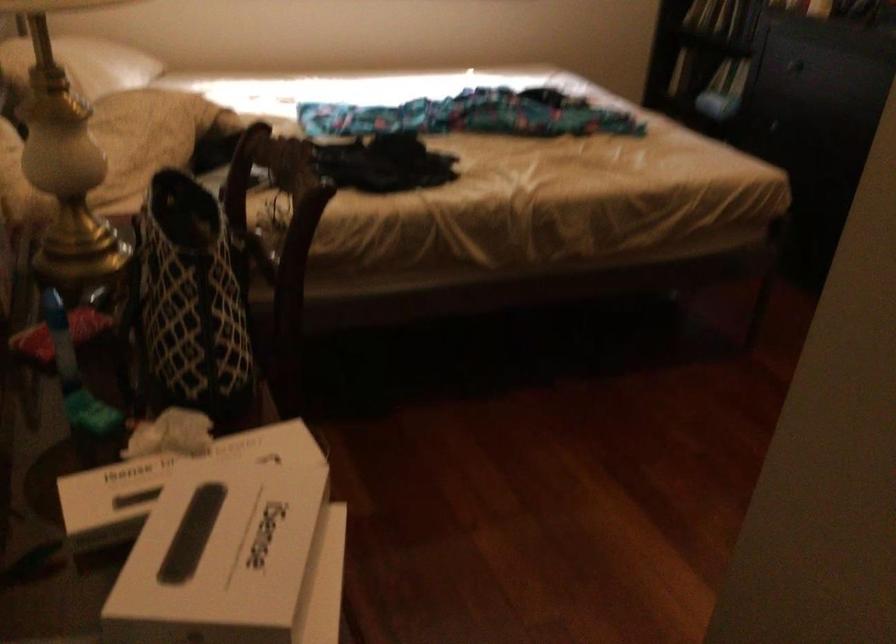
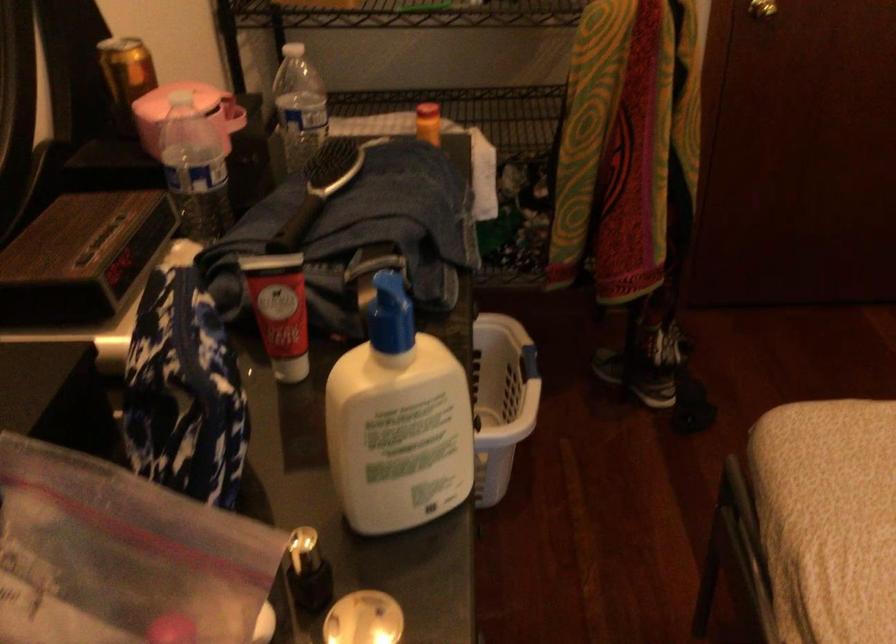
Where in the second image is the point corresponding to (748,155) from the first image?

(828, 488)